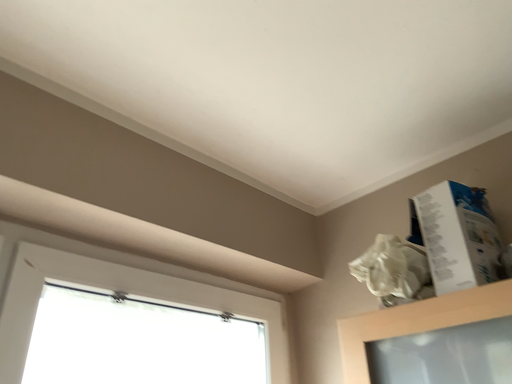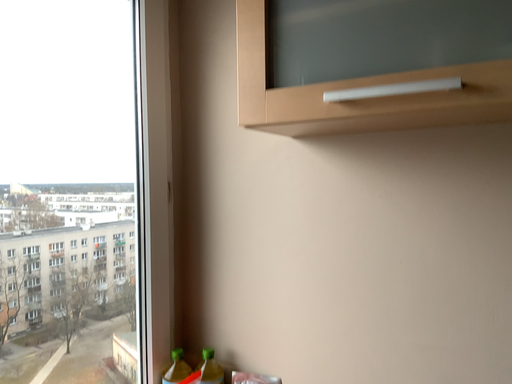
Question: How did the camera likely rotate when shooting the video?

Choices:
 (A) rotated right
 (B) rotated left

Answer: (A)